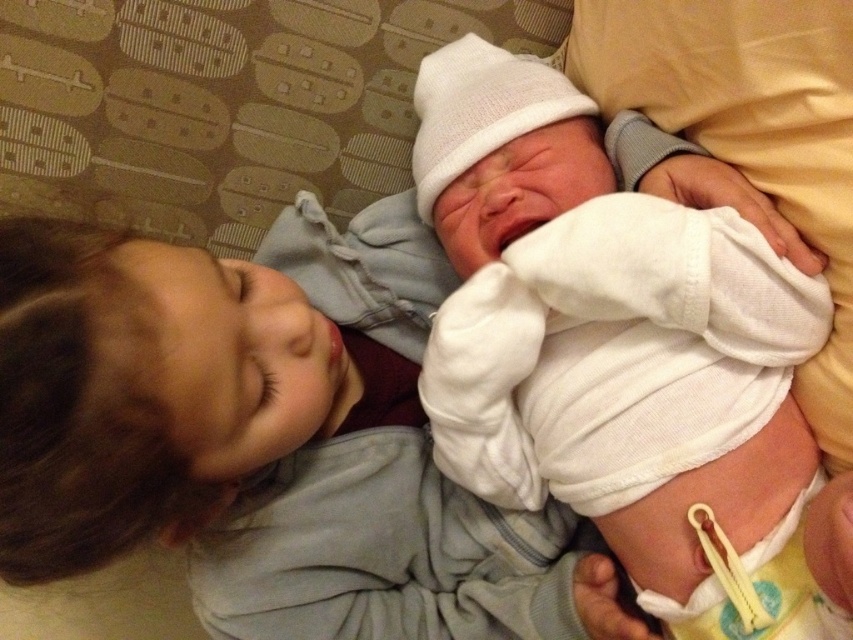
Question: Does white soft cloth at center appear on the right side of white cotton newborn at center?

Choices:
 (A) yes
 (B) no

Answer: (B)

Question: Which point appears farthest from the camera in this image?

Choices:
 (A) (630, 544)
 (B) (78, 372)

Answer: (A)

Question: Is white soft cloth at center smaller than white cotton newborn at center?

Choices:
 (A) no
 (B) yes

Answer: (A)

Question: Which point appears farthest from the camera in this image?

Choices:
 (A) (590, 184)
 (B) (254, 467)

Answer: (A)

Question: Which object is farther from the camera taking this photo?

Choices:
 (A) white cotton newborn at center
 (B) white soft cloth at center

Answer: (A)

Question: Is the position of white soft cloth at center more distant than that of white cotton newborn at center?

Choices:
 (A) yes
 (B) no

Answer: (B)